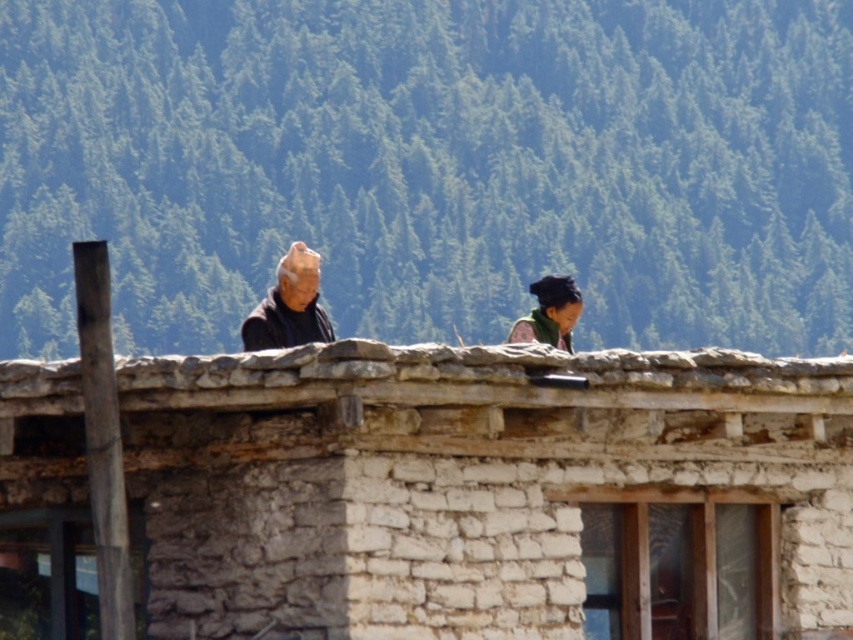
You are a hiker trying to determine the best path to reach the stone wall at center from the green textured hillside at upper center. Considering their sizes, which direction should you head towards?

The green textured hillside at upper center is larger in size than the stone wall at center, so you should head towards the smaller stone wall at center from the larger hillside.

You are standing in front of a rustic stone building with two people on its roof. There is a wooden pole leaning against the wall. You want to know the distance between the wooden pole and the point marked as point (167, 131). Can you determine this distance?

The distance between the wooden pole and point (167, 131) is 535.35 feet.